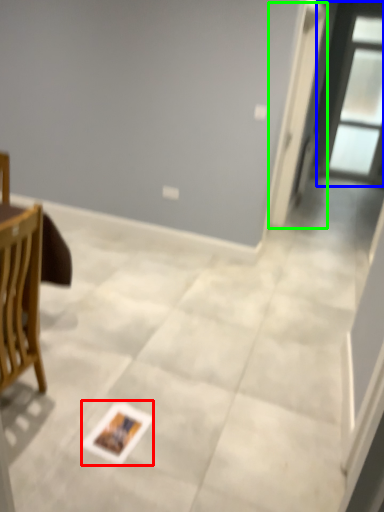
Question: Estimate the real-world distances between objects in this image. Which object is closer to postcard (highlighted by a red box), window (highlighted by a blue box) or screen door (highlighted by a green box)?

Choices:
 (A) window
 (B) screen door

Answer: (B)